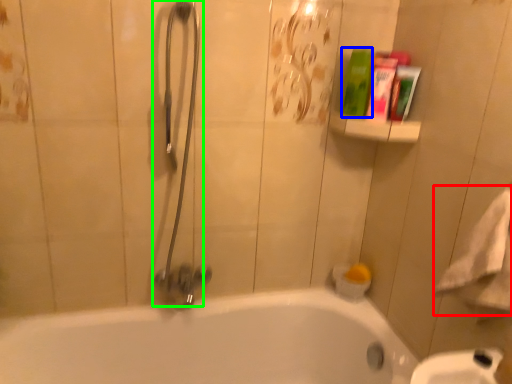
Question: Considering the real-world distances, which object is closest to bath towel (highlighted by a red box)? cleaning product (highlighted by a blue box) or shower (highlighted by a green box).

Choices:
 (A) cleaning product
 (B) shower

Answer: (A)